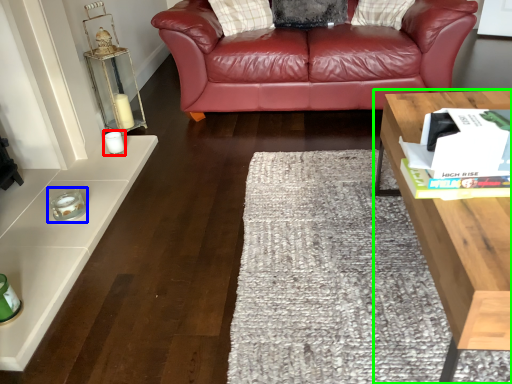
Question: Considering the real-world distances, which object is closest to candle holder (highlighted by a red box)? candle holder (highlighted by a blue box) or table (highlighted by a green box).

Choices:
 (A) candle holder
 (B) table

Answer: (A)